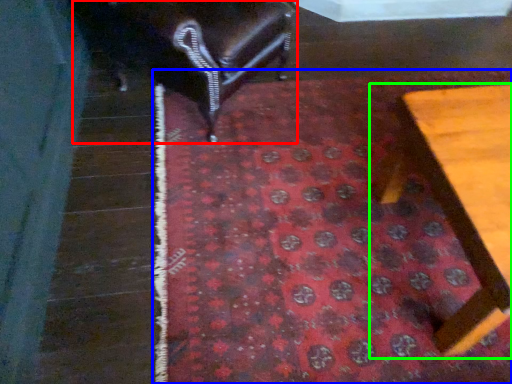
Question: Which object is the closest to the furniture (highlighted by a red box)? Choose among these: mat (highlighted by a blue box) or furniture (highlighted by a green box).

Choices:
 (A) mat
 (B) furniture

Answer: (A)